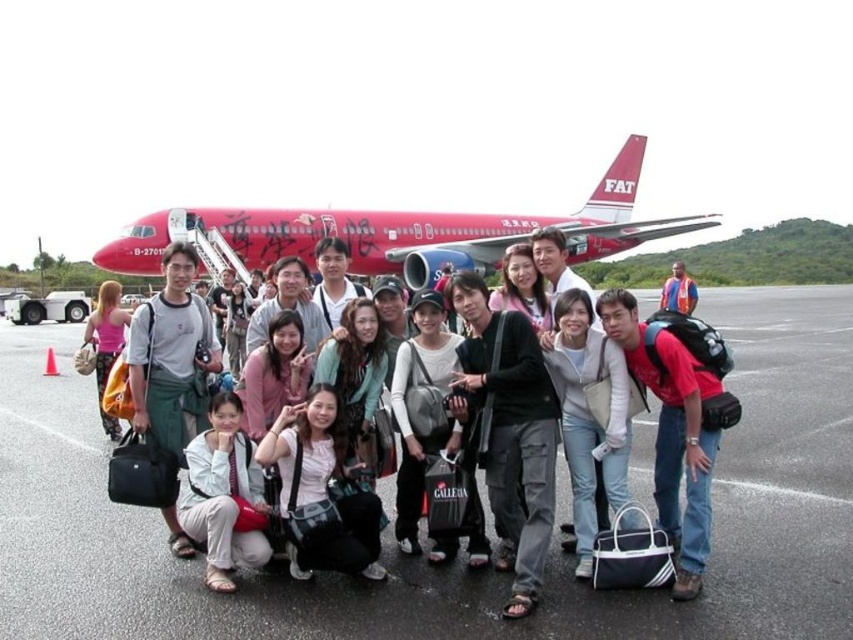
Can you confirm if black canvas bag at center is taller than matte pink top at center?

Indeed, black canvas bag at center has a greater height compared to matte pink top at center.

I want to click on black canvas bag at center, so click(x=508, y=429).

Locate an element on the screen. black canvas bag at center is located at coordinates (508, 429).

From the picture: Does pink matte shirt at center have a greater width compared to matte pink top at center?

No.

Does point (276, 417) come behind point (107, 323)?

No.

You are a GUI agent. You are given a task and a screenshot of the screen. Output one action in this format:
    pyautogui.click(x=<x>, y=<y>)
    Task: Click on the pink matte shirt at center
    The height and width of the screenshot is (640, 853).
    Given the screenshot: What is the action you would take?
    click(273, 374)

Can you confirm if black canvas bag at center is positioned above white fabric bag at center?

Yes, black canvas bag at center is above white fabric bag at center.

Between black canvas bag at center and white fabric bag at center, which one appears on the left side from the viewer's perspective?

white fabric bag at center is more to the left.

Which is behind, point (524, 612) or point (317, 385)?

The point (317, 385) is more distant.

You are a GUI agent. You are given a task and a screenshot of the screen. Output one action in this format:
    pyautogui.click(x=<x>, y=<y>)
    Task: Click on the black canvas bag at center
    The image size is (853, 640).
    Given the screenshot: What is the action you would take?
    pyautogui.click(x=508, y=429)